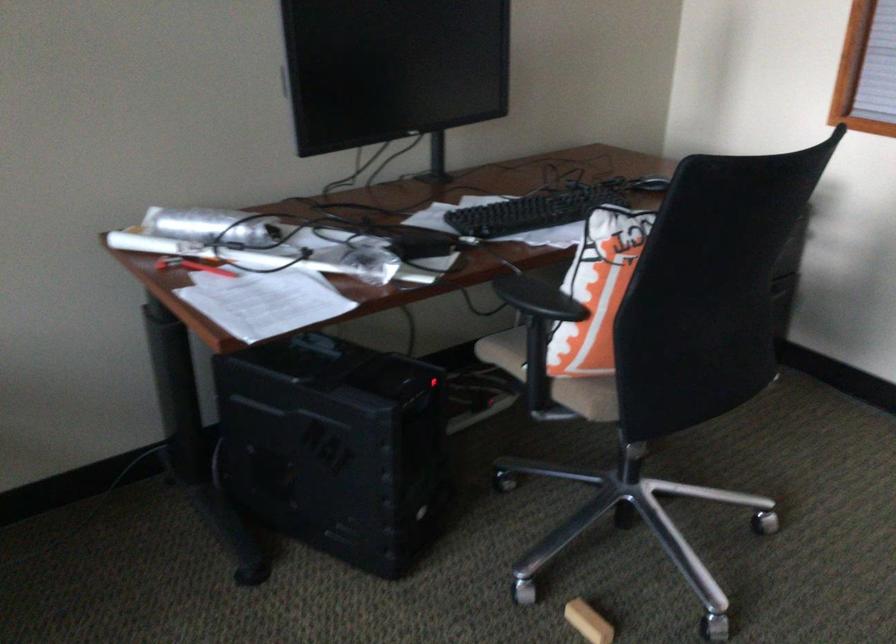
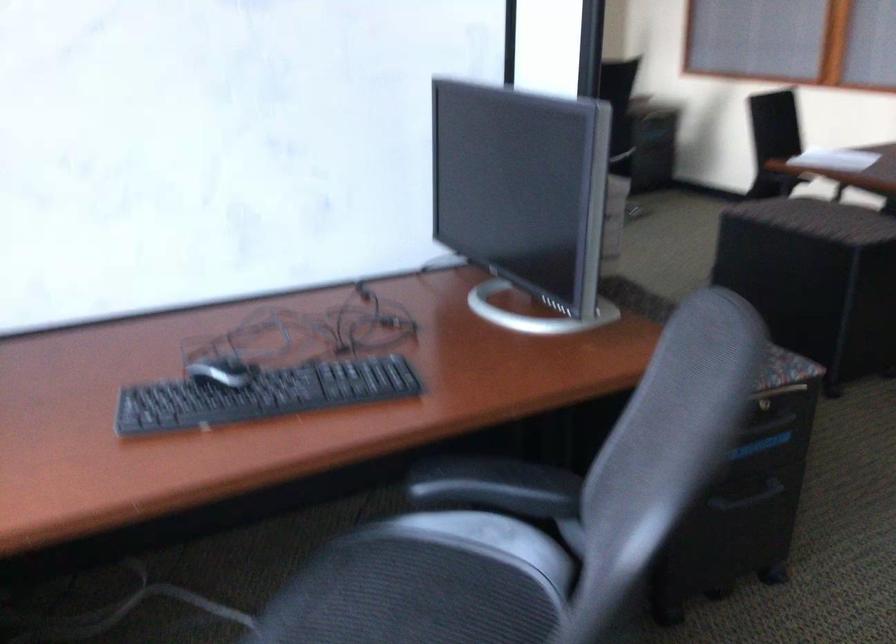
Question: Which direction would the cameraman need to move to produce the second image? Reply with the corresponding letter.

Choices:
 (A) Left
 (B) Right
 (C) Forward
 (D) Backward

Answer: (D)